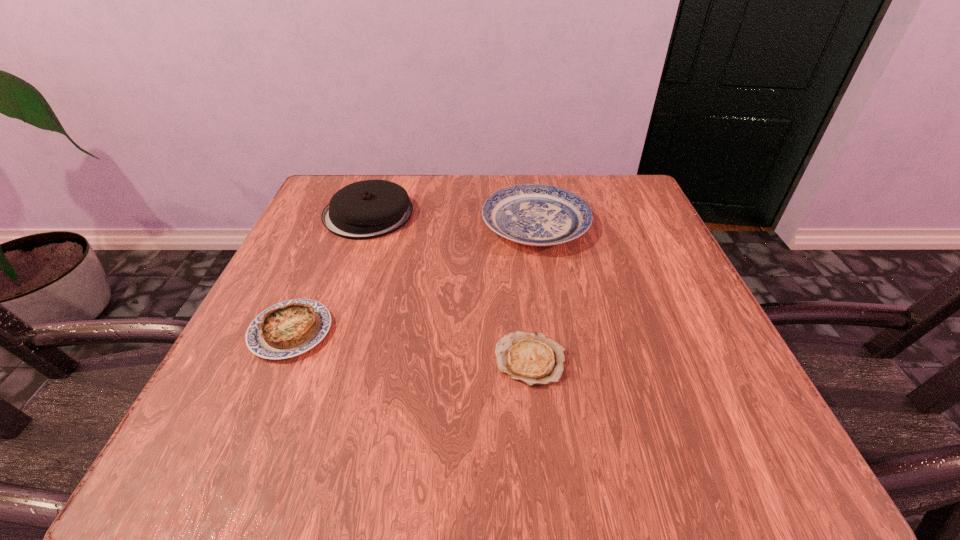
Image resolution: width=960 pixels, height=540 pixels. Identify the location of the tallest object. (368, 209).

Locate an element on the screen. Image resolution: width=960 pixels, height=540 pixels. plate is located at coordinates (531, 214).

Where is `the left quiche`? The width and height of the screenshot is (960, 540). the left quiche is located at coordinates (287, 329).

The image size is (960, 540). Find the location of `the taller quiche`. the taller quiche is located at coordinates (287, 329).

Locate an element on the screen. the shorter quiche is located at coordinates (533, 358).

You are a GUI agent. You are given a task and a screenshot of the screen. Output one action in this format:
    pyautogui.click(x=<x>, y=<y>)
    Task: Click on the shortest object
    
    Given the screenshot: What is the action you would take?
    pyautogui.click(x=533, y=358)

Where is `free point located 0.060m on the front of the tallest object`? free point located 0.060m on the front of the tallest object is located at coordinates (353, 259).

Where is `vacant space located on the left of the plate`? vacant space located on the left of the plate is located at coordinates (444, 225).

The image size is (960, 540). What are the coordinates of `vacant space located 0.170m on the back of the third tallest object` in the screenshot? It's located at (328, 245).

This screenshot has height=540, width=960. Identify the location of free region located 0.280m on the left of the shortest object. (312, 360).